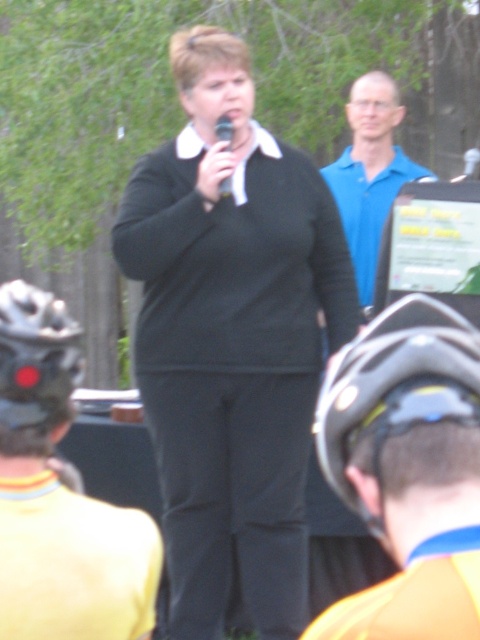
Question: Which is nearer to the black matte bicycle helmet at lower right?

Choices:
 (A) black matte microphone at center
 (B) camouflage fabric helmet at lower left
 (C) blue smooth shirt at upper center

Answer: (B)

Question: Among these objects, which one is nearest to the camera?

Choices:
 (A) black matte bicycle helmet at lower right
 (B) yellow fabric helmet at lower left
 (C) blue smooth shirt at upper center

Answer: (A)

Question: Does yellow fabric helmet at lower left have a smaller size compared to black matte bicycle helmet at lower right?

Choices:
 (A) yes
 (B) no

Answer: (B)

Question: Which point is closer to the camera?

Choices:
 (A) yellow fabric helmet at lower left
 (B) black matte sweater at center

Answer: (A)

Question: In this image, where is blue smooth shirt at upper center located relative to black matte microphone at center?

Choices:
 (A) left
 (B) right

Answer: (B)

Question: Can you confirm if blue smooth shirt at upper center is positioned below black matte microphone at center?

Choices:
 (A) yes
 (B) no

Answer: (B)